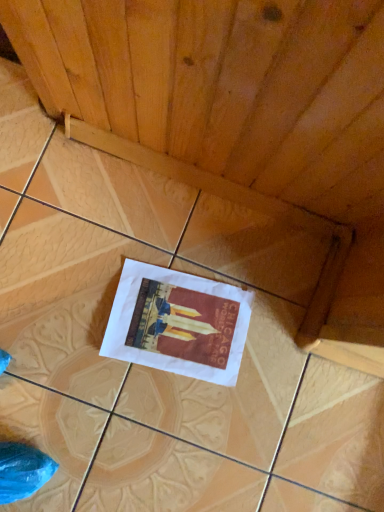
I want to click on space that is in front of white paper poster at center, so click(x=121, y=419).